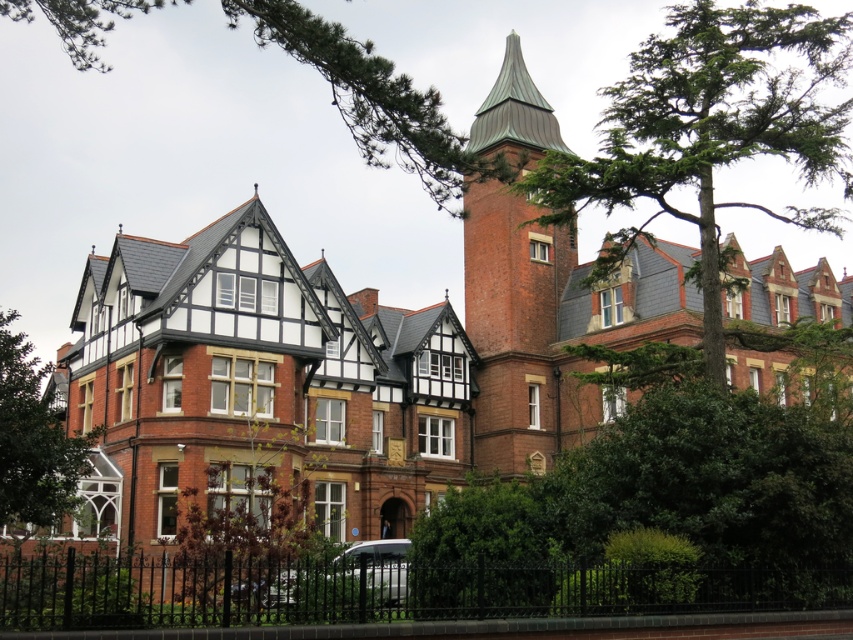
Question: Can you confirm if black wrought iron fence at lower center is positioned to the right of brick tower at center?

Choices:
 (A) no
 (B) yes

Answer: (A)

Question: Which of the following is the farthest from the observer?

Choices:
 (A) green leafy tree at center
 (B) white matte van at lower center
 (C) black wrought iron fence at lower center

Answer: (A)

Question: Estimate the real-world distances between objects in this image. Which object is farther from the green leafy tree at center?

Choices:
 (A) green leafy tree at upper right
 (B) black wrought iron fence at lower center
 (C) green leafy tree at lower left

Answer: (A)

Question: Can you confirm if green leafy tree at upper right is positioned to the right of brick tower at center?

Choices:
 (A) yes
 (B) no

Answer: (A)

Question: Does brick tower at center have a greater width compared to green leafy tree at center?

Choices:
 (A) yes
 (B) no

Answer: (B)

Question: Which object appears closest to the camera in this image?

Choices:
 (A) black wrought iron fence at lower center
 (B) white matte van at lower center
 (C) brick tower at center

Answer: (A)